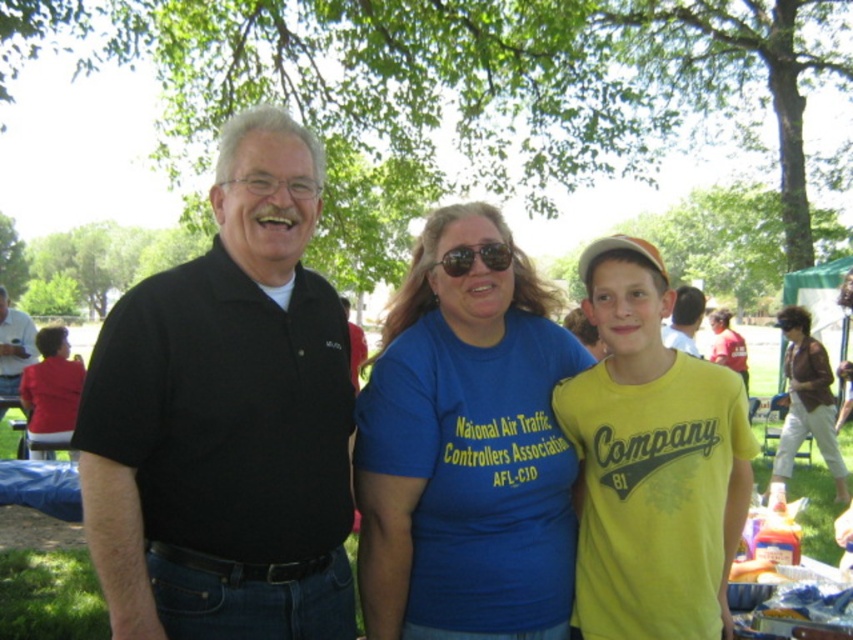
You are standing in the park and see two points in the image. The first point is at coordinate point (4, 310) and the second is at point (679, 292). Which point is closer to you?

Point (4, 310) is closer to you because it is further to the viewer than point (679, 292).